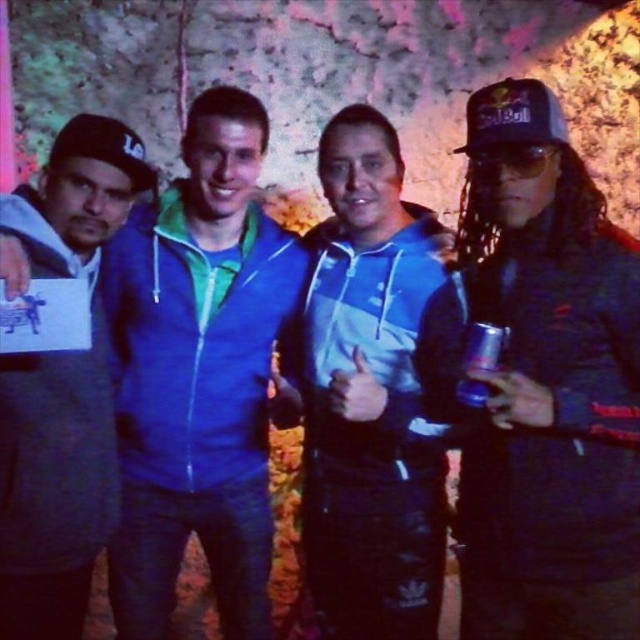
Can you confirm if shiny black jacket at right is positioned below blue metallic can at right?

Yes, shiny black jacket at right is below blue metallic can at right.

Which is in front, point (522, 365) or point (497, 344)?

Point (497, 344)

You are a GUI agent. You are given a task and a screenshot of the screen. Output one action in this format:
    pyautogui.click(x=<x>, y=<y>)
    Task: Click on the shiny black jacket at right
    The width and height of the screenshot is (640, 640).
    Given the screenshot: What is the action you would take?
    pyautogui.click(x=547, y=384)

Who is more distant from viewer, (554, 429) or (20, 376)?

The point (20, 376) is behind.

Between shiny black jacket at right and gray hoodie at left, which one has more height?

Standing taller between the two is gray hoodie at left.

Is point (611, 252) less distant than point (92, 352)?

Yes, it is in front of point (92, 352).

Locate an element on the screen. shiny black jacket at right is located at coordinates (547, 384).

Can you confirm if shiny black jacket at right is positioned to the left of blue zip-up jacket at center?

In fact, shiny black jacket at right is to the right of blue zip-up jacket at center.

Is shiny black jacket at right positioned before blue zip-up jacket at center?

Yes, shiny black jacket at right is in front of blue zip-up jacket at center.

The image size is (640, 640). Describe the element at coordinates (547, 384) in the screenshot. I see `shiny black jacket at right` at that location.

This screenshot has height=640, width=640. Identify the location of shiny black jacket at right. 547,384.